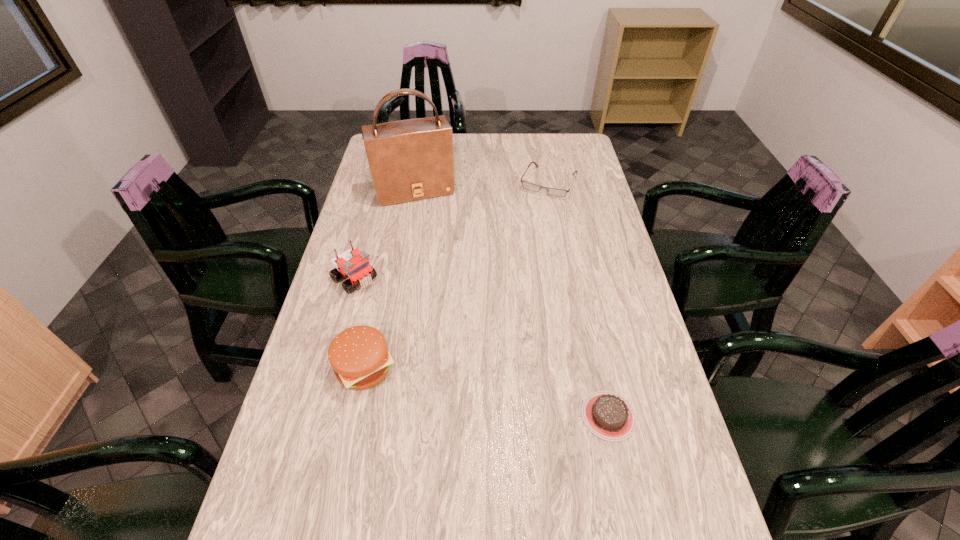
The image size is (960, 540). What are the coordinates of `chocolate cake present at the right edge` in the screenshot? It's located at (608, 415).

Identify the location of spectacles that is at the right edge. Image resolution: width=960 pixels, height=540 pixels. (529, 186).

Locate an element on the screen. The width and height of the screenshot is (960, 540). vacant region at the far edge is located at coordinates (514, 151).

In the image, there is a desktop. Where is `vacant space at the left edge`? The width and height of the screenshot is (960, 540). vacant space at the left edge is located at coordinates (357, 199).

At what (x,y) coordinates should I click in order to perform the action: click on free space at the right edge of the desktop. Please return your answer as a coordinate pair (x, y). The image size is (960, 540). Looking at the image, I should click on (567, 176).

This screenshot has width=960, height=540. In the image, there is a desktop. Find the location of `vacant space at the near left corner`. vacant space at the near left corner is located at coordinates (324, 538).

The height and width of the screenshot is (540, 960). In order to click on blank area at the far right corner in this screenshot , I will do `click(586, 160)`.

Locate an element on the screen. The image size is (960, 540). vacant point located between the hamburger and the chocolate cake is located at coordinates (486, 392).

Image resolution: width=960 pixels, height=540 pixels. I want to click on vacant area between the second shortest object and the third shortest object, so click(x=456, y=275).

Identify the location of free space between the fourth shortest object and the chocolate cake. The width and height of the screenshot is (960, 540). (482, 347).